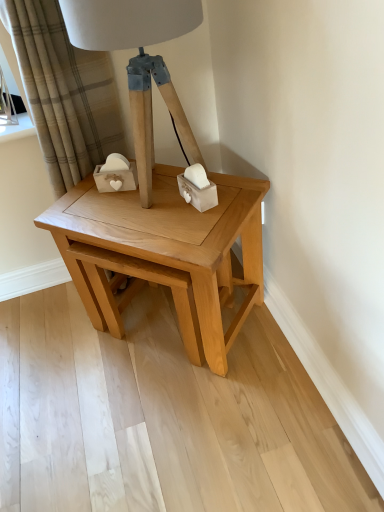
Question: From a real-world perspective, is matte wood table lamp at center physically above beige plaid curtain at upper left?

Choices:
 (A) yes
 (B) no

Answer: (A)

Question: Can you see matte wood table lamp at center touching beige plaid curtain at upper left?

Choices:
 (A) no
 (B) yes

Answer: (A)

Question: Can you confirm if matte wood table lamp at center is positioned to the right of beige plaid curtain at upper left?

Choices:
 (A) no
 (B) yes

Answer: (B)

Question: Considering the relative sizes of matte wood table lamp at center and beige plaid curtain at upper left in the image provided, is matte wood table lamp at center wider than beige plaid curtain at upper left?

Choices:
 (A) yes
 (B) no

Answer: (A)

Question: Does matte wood table lamp at center turn towards beige plaid curtain at upper left?

Choices:
 (A) no
 (B) yes

Answer: (A)

Question: Is the position of matte wood table lamp at center less distant than that of beige plaid curtain at upper left?

Choices:
 (A) no
 (B) yes

Answer: (B)

Question: Is matte wood table lamp at center wider than natural wood table at center?

Choices:
 (A) yes
 (B) no

Answer: (B)

Question: Is the position of matte wood table lamp at center more distant than that of natural wood table at center?

Choices:
 (A) yes
 (B) no

Answer: (B)

Question: From a real-world perspective, does matte wood table lamp at center stand above natural wood table at center?

Choices:
 (A) yes
 (B) no

Answer: (A)

Question: From the image's perspective, does matte wood table lamp at center appear higher than natural wood table at center?

Choices:
 (A) yes
 (B) no

Answer: (A)

Question: Is matte wood table lamp at center located outside natural wood table at center?

Choices:
 (A) no
 (B) yes

Answer: (B)

Question: Is matte wood table lamp at center facing away from natural wood table at center?

Choices:
 (A) no
 (B) yes

Answer: (A)

Question: Considering the relative positions of beige plaid curtain at upper left and natural wood table at center in the image provided, is beige plaid curtain at upper left to the right of natural wood table at center from the viewer's perspective?

Choices:
 (A) yes
 (B) no

Answer: (B)